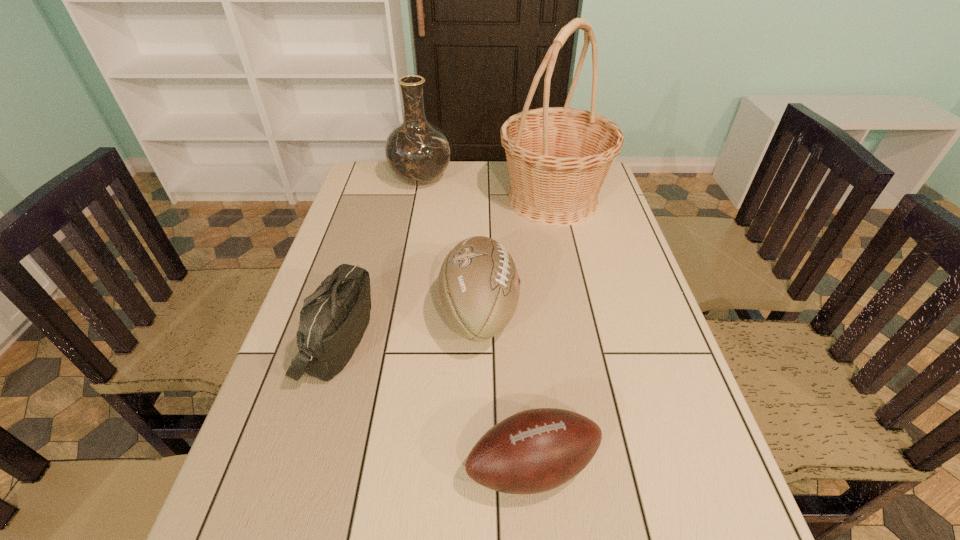
Locate an element on the screen. blank area in the image that satisfies the following two spatial constraints: 1. on the back side of the tallest object; 2. on the left side of the nearest object is located at coordinates (509, 200).

Locate an element on the screen. This screenshot has height=540, width=960. free space that satisfies the following two spatial constraints: 1. at the front padded panel of the shortest object; 2. on the left side of the shoulder bag is located at coordinates (300, 467).